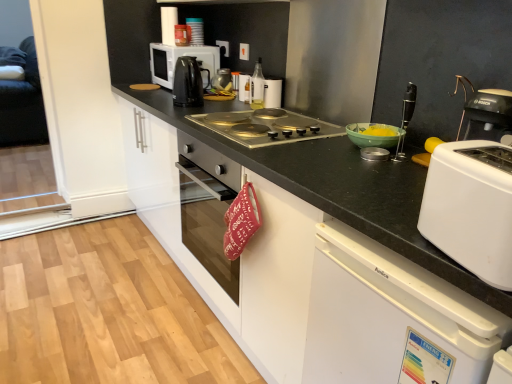
Question: Is clear glass bottle at center, the seventh kitchen appliance from the left, to the left of metallic silver canister at upper center, which is counted as the 3th kitchen appliance, starting from the left, from the viewer's perspective?

Choices:
 (A) yes
 (B) no

Answer: (B)

Question: From the image's perspective, is clear glass bottle at center, the second kitchen appliance in the right-to-left sequence, on metallic silver canister at upper center, which is counted as the 3th kitchen appliance, starting from the left?

Choices:
 (A) no
 (B) yes

Answer: (A)

Question: Is clear glass bottle at center, the seventh kitchen appliance from the left, smaller than metallic silver canister at upper center, arranged as the 6th kitchen appliance when viewed from the right?

Choices:
 (A) no
 (B) yes

Answer: (A)

Question: Considering the relative sizes of clear glass bottle at center, the second kitchen appliance in the right-to-left sequence, and metallic silver canister at upper center, arranged as the 6th kitchen appliance when viewed from the right, in the image provided, is clear glass bottle at center, the second kitchen appliance in the right-to-left sequence, wider than metallic silver canister at upper center, arranged as the 6th kitchen appliance when viewed from the right,?

Choices:
 (A) no
 (B) yes

Answer: (A)

Question: Considering the relative positions of clear glass bottle at center, the seventh kitchen appliance from the left, and metallic silver canister at upper center, arranged as the 6th kitchen appliance when viewed from the right, in the image provided, is clear glass bottle at center, the seventh kitchen appliance from the left, to the right of metallic silver canister at upper center, arranged as the 6th kitchen appliance when viewed from the right, from the viewer's perspective?

Choices:
 (A) no
 (B) yes

Answer: (B)

Question: In the image, is translucent glass bottle at center, the sixth kitchen appliance viewed from the left, positioned in front of or behind clear glass bottle at center, the second kitchen appliance in the right-to-left sequence?

Choices:
 (A) behind
 (B) front

Answer: (A)

Question: Would you say translucent glass bottle at center, positioned as the 3th kitchen appliance in right-to-left order, is inside or outside clear glass bottle at center, the second kitchen appliance in the right-to-left sequence?

Choices:
 (A) inside
 (B) outside

Answer: (B)

Question: Is translucent glass bottle at center, positioned as the 3th kitchen appliance in right-to-left order, taller or shorter than clear glass bottle at center, the seventh kitchen appliance from the left?

Choices:
 (A) short
 (B) tall

Answer: (A)

Question: From a real-world perspective, is translucent glass bottle at center, the sixth kitchen appliance viewed from the left, above or below clear glass bottle at center, the seventh kitchen appliance from the left?

Choices:
 (A) above
 (B) below

Answer: (B)

Question: In terms of size, does metallic silver gas stove at center appear bigger or smaller than translucent glass bottle at center, positioned as the 3th kitchen appliance in right-to-left order?

Choices:
 (A) big
 (B) small

Answer: (A)

Question: Which is correct: metallic silver gas stove at center is inside translucent glass bottle at center, the sixth kitchen appliance viewed from the left, or outside of it?

Choices:
 (A) inside
 (B) outside

Answer: (B)

Question: Does point (232, 115) appear closer or farther from the camera than point (241, 84)?

Choices:
 (A) farther
 (B) closer

Answer: (B)

Question: Considering the positions of metallic silver gas stove at center and translucent glass bottle at center, positioned as the 3th kitchen appliance in right-to-left order, in the image, is metallic silver gas stove at center wider or thinner than translucent glass bottle at center, positioned as the 3th kitchen appliance in right-to-left order,?

Choices:
 (A) thin
 (B) wide

Answer: (B)

Question: Considering the positions of black glossy electric kettle at upper center, the fourth kitchen appliance when ordered from left to right, and metallic silver gas stove at center in the image, is black glossy electric kettle at upper center, the fourth kitchen appliance when ordered from left to right, bigger or smaller than metallic silver gas stove at center?

Choices:
 (A) small
 (B) big

Answer: (A)

Question: Looking at their shapes, would you say black glossy electric kettle at upper center, the fifth kitchen appliance viewed from the right, is wider or thinner than metallic silver gas stove at center?

Choices:
 (A) wide
 (B) thin

Answer: (B)